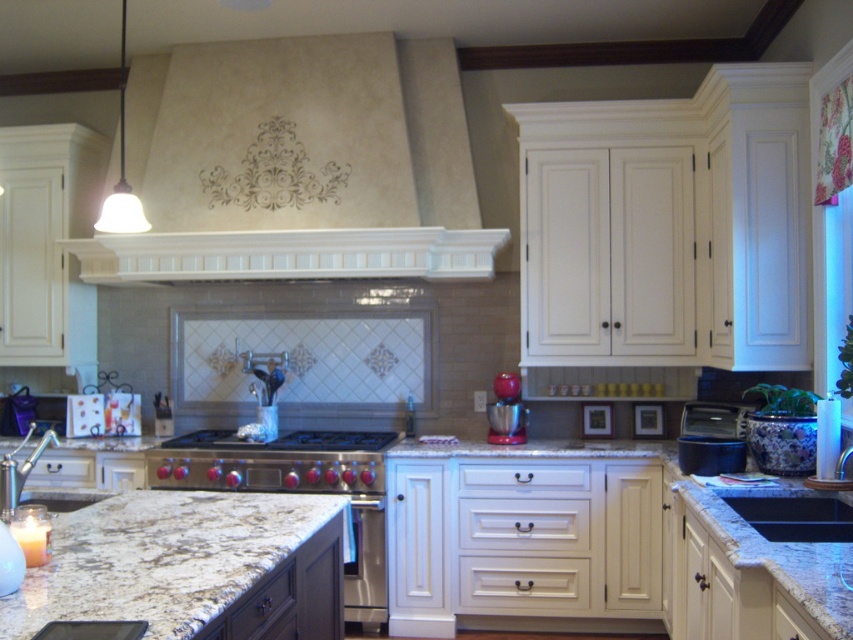
Question: Which of the following is the closest to the observer?

Choices:
 (A) (682, 456)
 (B) (442, 499)
 (C) (376, 484)

Answer: (A)

Question: Does stainless steel stove at center have a larger size compared to black granite sink at center?

Choices:
 (A) no
 (B) yes

Answer: (B)

Question: Which of the following is the closest to the observer?

Choices:
 (A) (318, 445)
 (B) (277, 67)

Answer: (A)

Question: Can you confirm if matte beige exhaust hood at upper center is bigger than white marble countertop at center?

Choices:
 (A) yes
 (B) no

Answer: (B)

Question: Does matte beige exhaust hood at upper center have a lesser width compared to stainless steel gas stove at center?

Choices:
 (A) yes
 (B) no

Answer: (B)

Question: Which of the following is the farthest from the observer?

Choices:
 (A) click(x=793, y=540)
 (B) click(x=277, y=438)

Answer: (B)